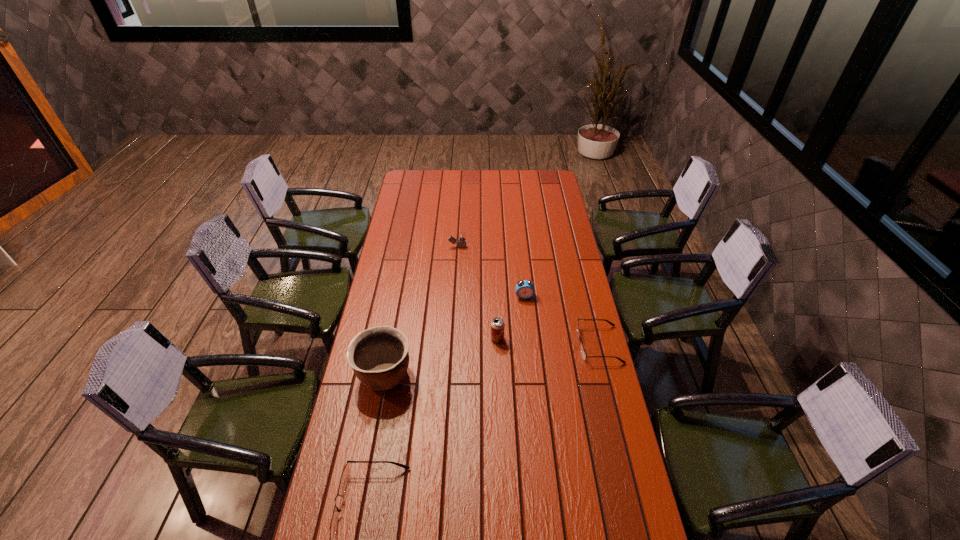
Find the location of a particular element. Image resolution: width=960 pixels, height=540 pixels. blank space at the far left corner is located at coordinates (424, 187).

Locate an element on the screen. vacant space at the far right corner of the desktop is located at coordinates (546, 183).

Where is `vacant area that lies between the tallest object and the shorter spectacles`? The image size is (960, 540). vacant area that lies between the tallest object and the shorter spectacles is located at coordinates (492, 359).

At what (x,y) coordinates should I click in order to perform the action: click on unoccupied area between the shorter spectacles and the alarm clock. Please return your answer as a coordinate pair (x, y). The height and width of the screenshot is (540, 960). Looking at the image, I should click on (562, 320).

The width and height of the screenshot is (960, 540). I want to click on free space between the third object from left to right and the pottery, so click(x=420, y=310).

Where is `vacant area between the farther spectacles and the pottery`? vacant area between the farther spectacles and the pottery is located at coordinates (492, 359).

Identify the location of empty location between the beer can and the farthest object. The image size is (960, 540). (477, 293).

Find the location of a particular element. unoccupied area between the pottery and the farther spectacles is located at coordinates (492, 359).

Identify the location of blank region between the beer can and the fourth object from right to left. (477, 293).

This screenshot has width=960, height=540. I want to click on empty space that is in between the tallest object and the igniter, so click(x=420, y=310).